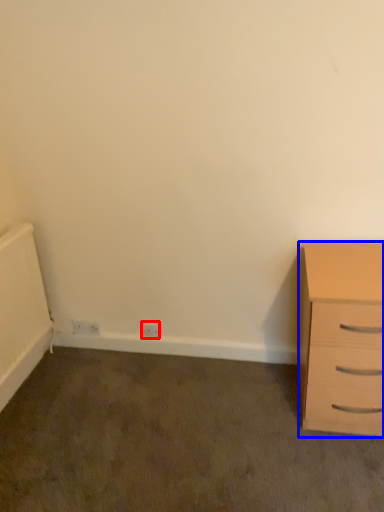
Question: Which of the following is the closest to the observer, electric outlet (highlighted by a red box) or chest of drawers (highlighted by a blue box)?

Choices:
 (A) electric outlet
 (B) chest of drawers

Answer: (B)